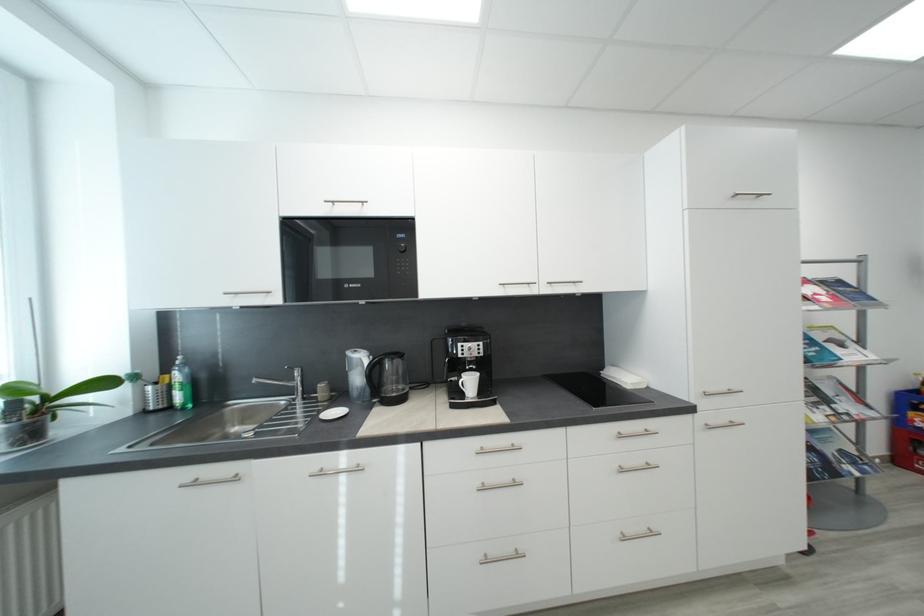
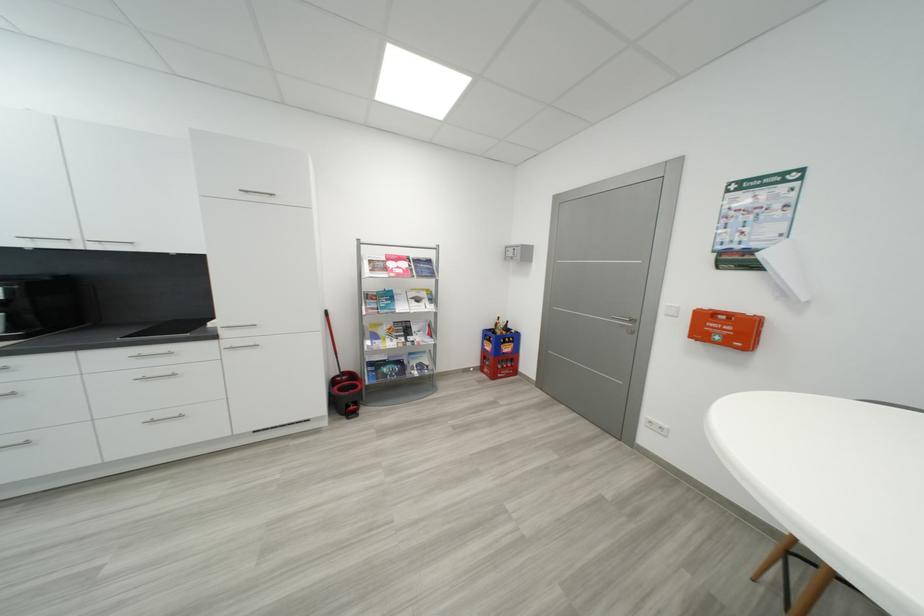
What movement of the cameraman would produce the second image?

The movement direction of the cameraman is right, backward.